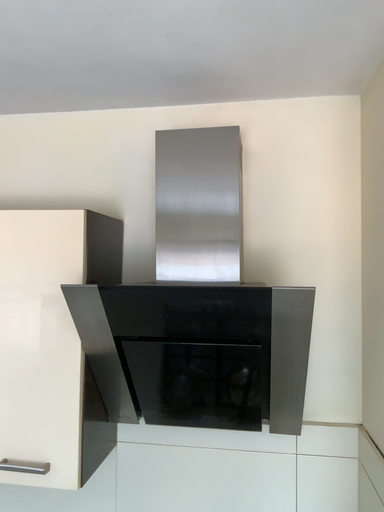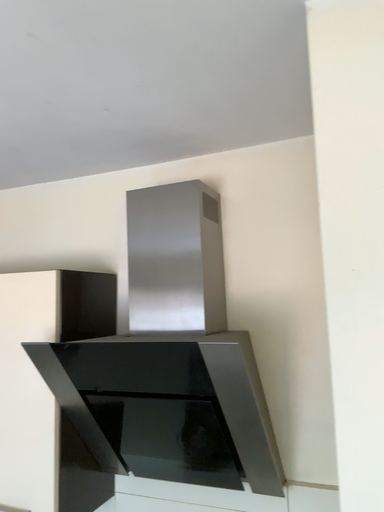
Question: How did the camera likely rotate when shooting the video?

Choices:
 (A) rotated left
 (B) rotated right

Answer: (A)